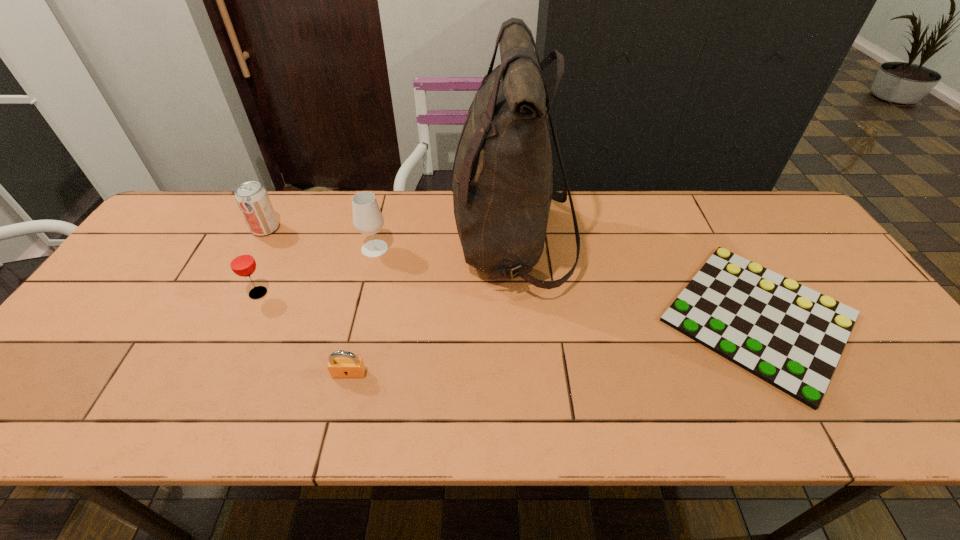
Where is `vacant area that lies between the shortest object and the shorter glass`? This screenshot has width=960, height=540. vacant area that lies between the shortest object and the shorter glass is located at coordinates (509, 305).

The width and height of the screenshot is (960, 540). I want to click on vacant area that lies between the fifth object from left to right and the shorter glass, so click(385, 268).

Locate an element on the screen. Image resolution: width=960 pixels, height=540 pixels. vacant space in between the soda can and the padlock is located at coordinates (307, 301).

The width and height of the screenshot is (960, 540). Identify the location of free space between the padlock and the nearer glass. (303, 333).

Find the location of a particular element. empty space between the backpack and the shortest object is located at coordinates (636, 281).

At what (x,y) coordinates should I click in order to perform the action: click on empty location between the left glass and the soda can. Please return your answer as a coordinate pair (x, y). Looking at the image, I should click on (262, 261).

At what (x,y) coordinates should I click in order to perform the action: click on free space between the farther glass and the left glass. Please return your answer as a coordinate pair (x, y). Looking at the image, I should click on (317, 271).

Select which object is the closest to the padlock. Please provide its 2D coordinates. Your answer should be formatted as a tuple, i.e. [(x, y)], where the tuple contains the x and y coordinates of a point satisfying the conditions above.

[(502, 189)]

Choose which object is the nearest neighbor to the nearer glass. Please provide its 2D coordinates. Your answer should be formatted as a tuple, i.e. [(x, y)], where the tuple contains the x and y coordinates of a point satisfying the conditions above.

[(252, 198)]

Identify the location of free space that satisfies the following two spatial constraints: 1. on the open flap of the fifth object from left to right; 2. to unlock the padlock from the front. (522, 374).